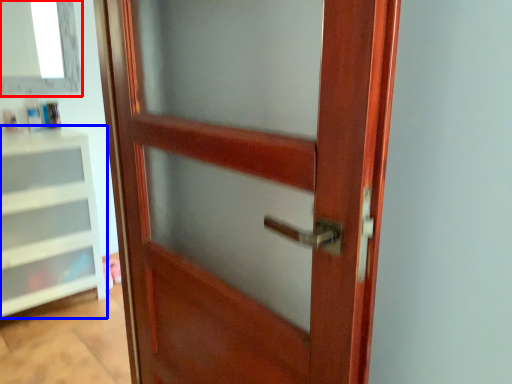
Question: Which point is further to the camera, window (highlighted by a red box) or shelf (highlighted by a blue box)?

Choices:
 (A) window
 (B) shelf

Answer: (A)